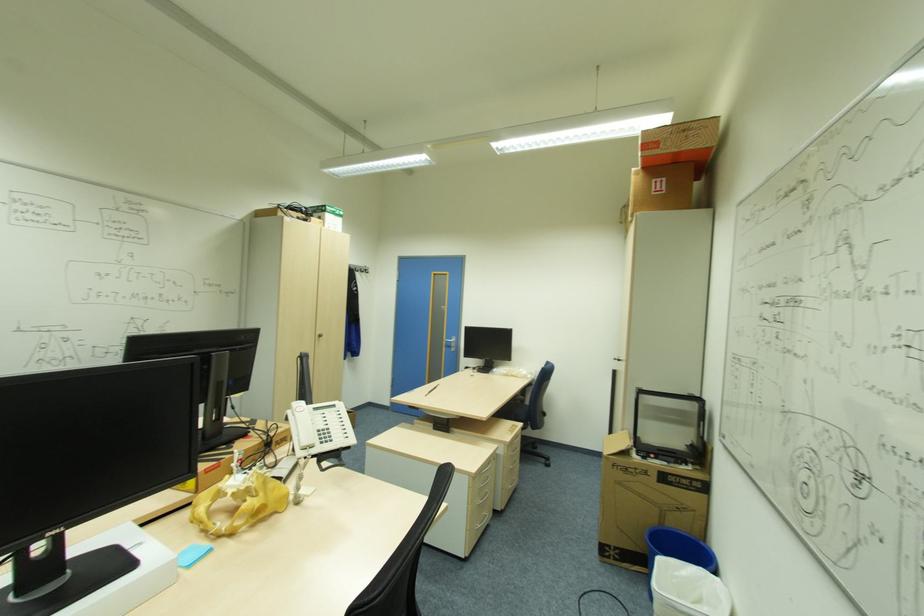
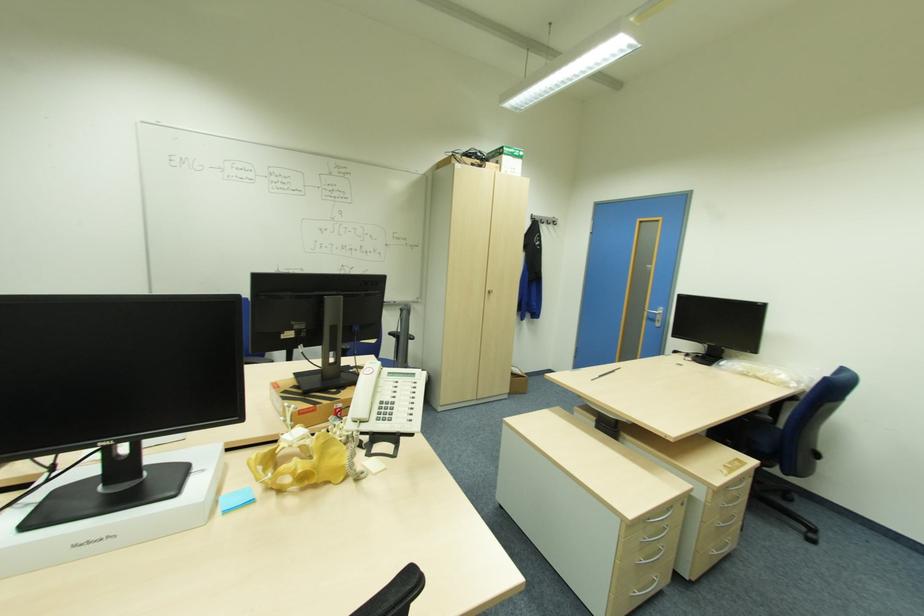
Where in the second image is the point corresponding to (x=235, y=533) from the first image?

(283, 490)